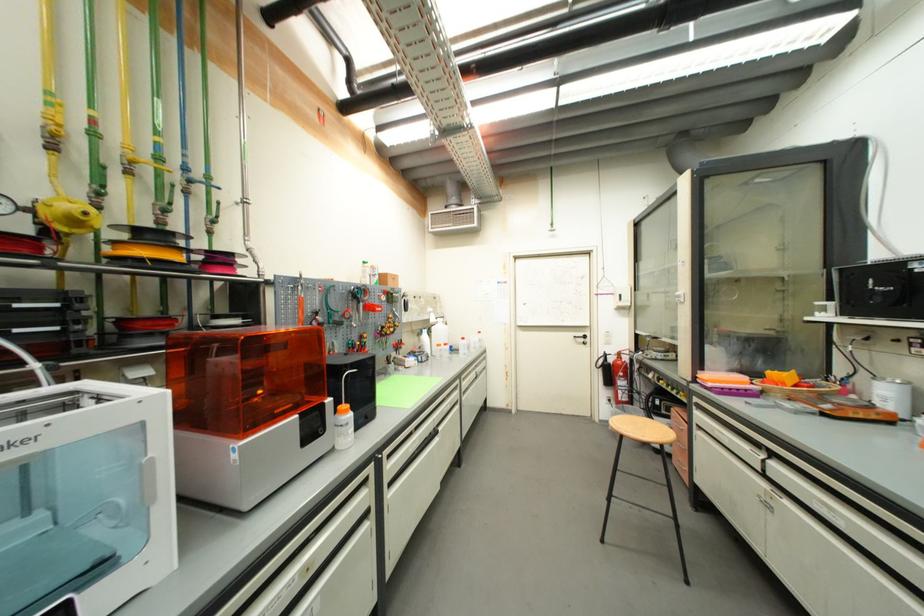
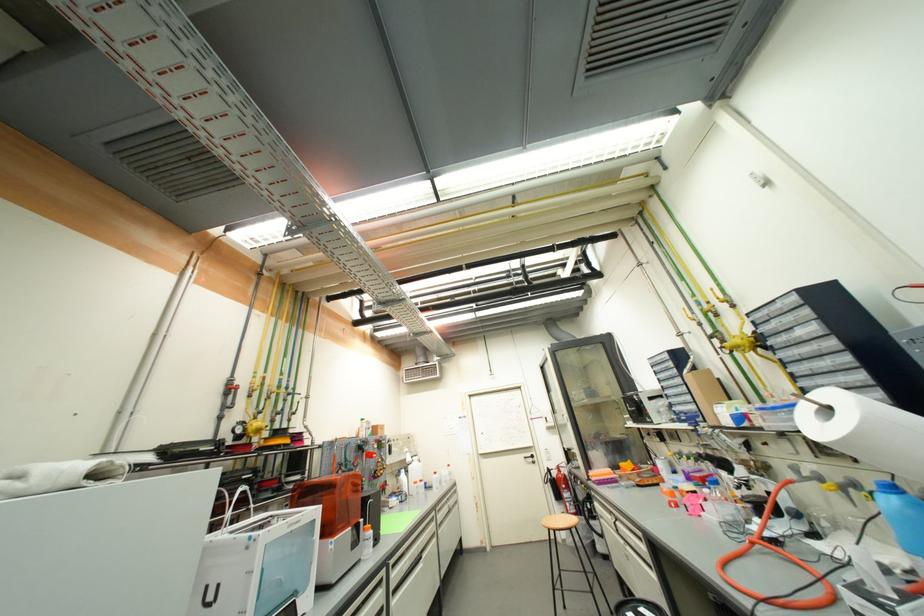
The point at (x=675, y=516) is marked in the first image. Where is the corresponding point in the second image?

(594, 592)